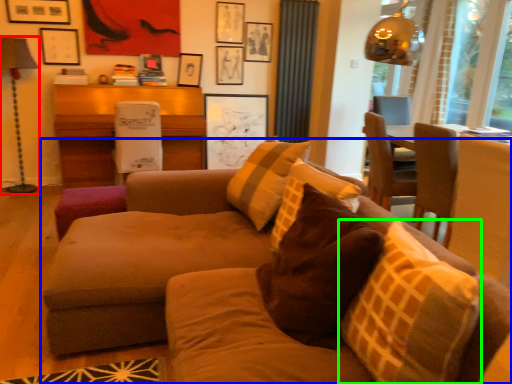
Question: Which object is positioned farthest from lamp (highlighted by a red box)? Select from studio couch (highlighted by a blue box) and throw pillow (highlighted by a green box).

Choices:
 (A) studio couch
 (B) throw pillow

Answer: (B)